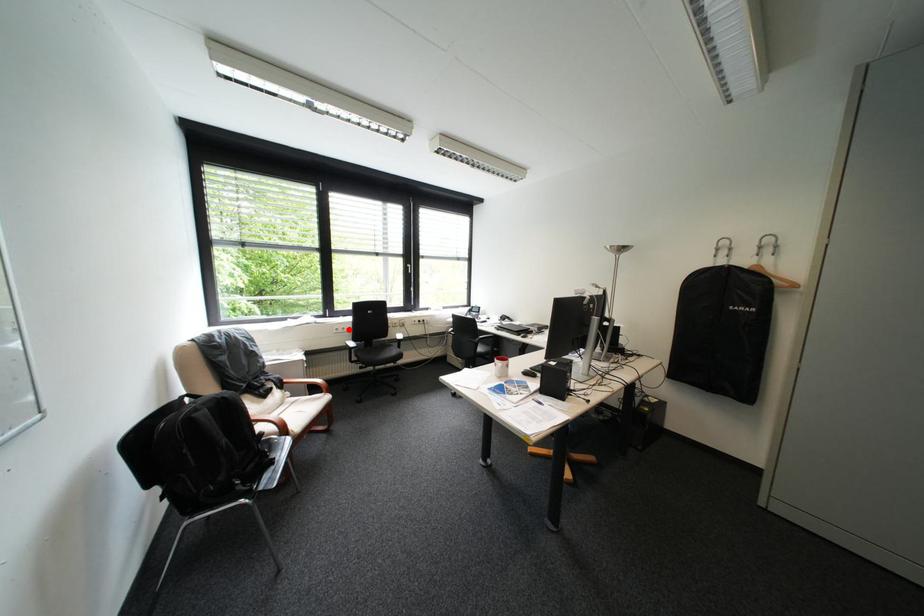
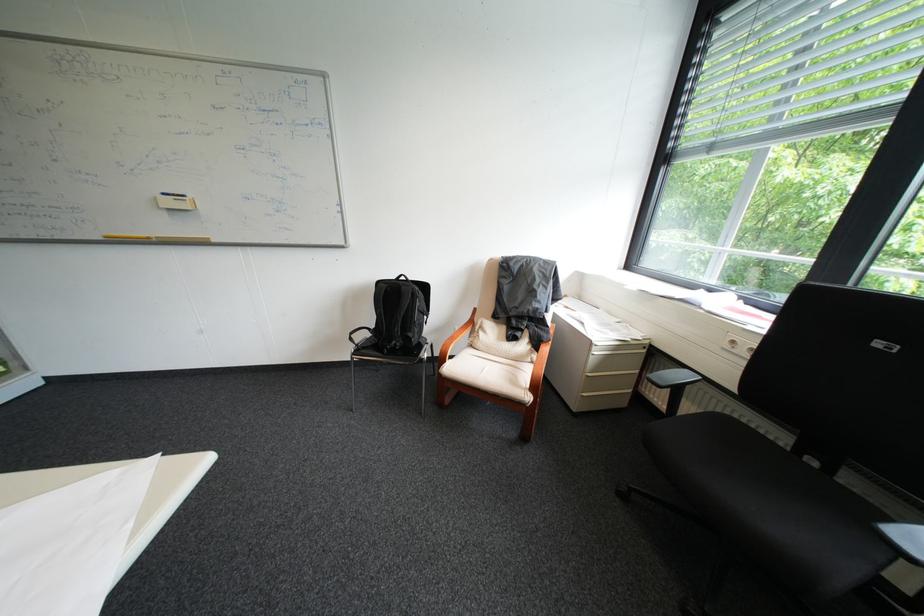
Question: I am providing you with two images of the same scene from different viewpoints. Given a red point in image1, look at the same physical point in image2. Is it:

Choices:
 (A) Closer to the viewpoint
 (B) Farther from the viewpoint

Answer: (A)